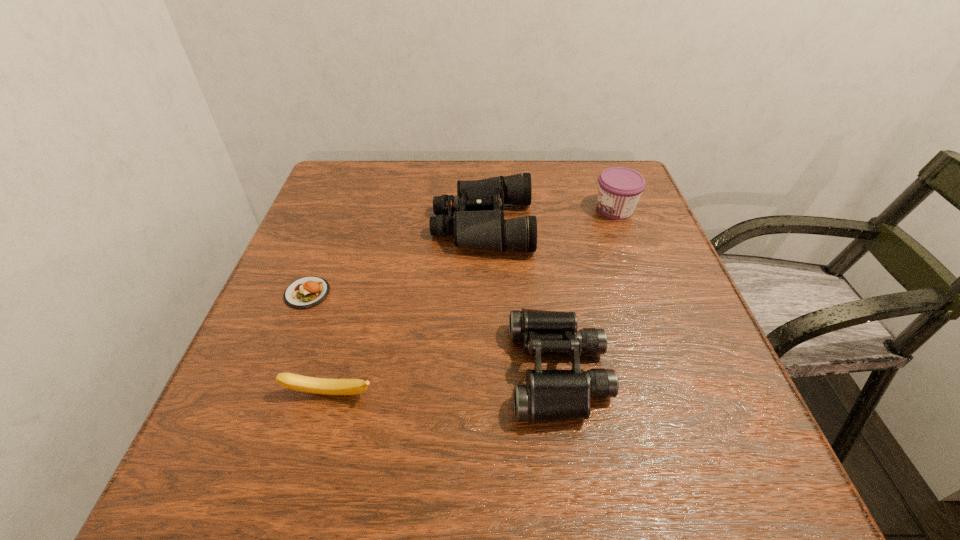
Identify the location of vacant space located through the eyepieces of the farther binoculars. The image size is (960, 540). (304, 225).

Locate an element on the screen. The image size is (960, 540). blank space located through the eyepieces of the farther binoculars is located at coordinates (325, 225).

Find the location of a particular element. The width and height of the screenshot is (960, 540). free region located 0.160m on the front-facing side of the nearer binoculars is located at coordinates (417, 372).

Find the location of a particular element. The width and height of the screenshot is (960, 540). free space located on the front-facing side of the nearer binoculars is located at coordinates (345, 372).

Identify the location of free space located 0.220m on the front-facing side of the nearer binoculars. This screenshot has height=540, width=960. (381, 372).

The image size is (960, 540). Find the location of `vacant space situated 0.120m at the stem of the fourth tallest object`. vacant space situated 0.120m at the stem of the fourth tallest object is located at coordinates (306, 481).

You are a GUI agent. You are given a task and a screenshot of the screen. Output one action in this format:
    pyautogui.click(x=<x>, y=<y>)
    Task: Click on the blank space located 0.380m on the right of the patty (food)
    
    Given the screenshot: What is the action you would take?
    click(521, 293)

The width and height of the screenshot is (960, 540). Find the location of `jam that is positioned at the far edge`. jam that is positioned at the far edge is located at coordinates (619, 190).

You are a GUI agent. You are given a task and a screenshot of the screen. Output one action in this format:
    pyautogui.click(x=<x>, y=<y>)
    Task: Click on the binoculars situated at the far edge
    The height and width of the screenshot is (540, 960).
    Given the screenshot: What is the action you would take?
    pyautogui.click(x=478, y=222)

Find the location of a particular element. This screenshot has height=540, width=960. banana located in the left edge section of the desktop is located at coordinates (325, 386).